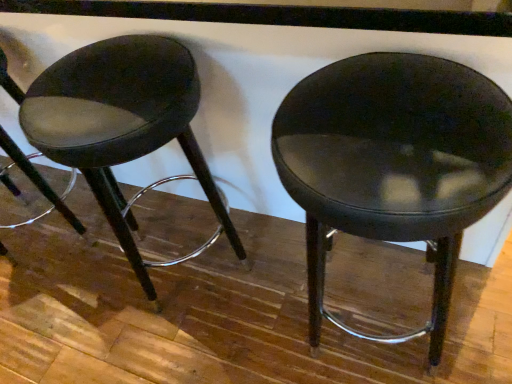
Question: Is matte black stool at left wider or thinner than matte black stool at center?

Choices:
 (A) wide
 (B) thin

Answer: (B)

Question: Choose the correct answer: Is matte black stool at left inside matte black stool at center or outside it?

Choices:
 (A) inside
 (B) outside

Answer: (B)

Question: From the image's perspective, is matte black stool at left positioned above or below matte black stool at center?

Choices:
 (A) below
 (B) above

Answer: (B)

Question: Is matte black stool at center taller or shorter than matte black stool at left?

Choices:
 (A) short
 (B) tall

Answer: (B)

Question: From the image's perspective, is matte black stool at center located above or below matte black stool at left?

Choices:
 (A) below
 (B) above

Answer: (A)

Question: Considering the positions of matte black stool at center and matte black stool at left in the image, is matte black stool at center bigger or smaller than matte black stool at left?

Choices:
 (A) big
 (B) small

Answer: (A)

Question: Is matte black stool at center inside or outside of matte black stool at left?

Choices:
 (A) outside
 (B) inside

Answer: (A)